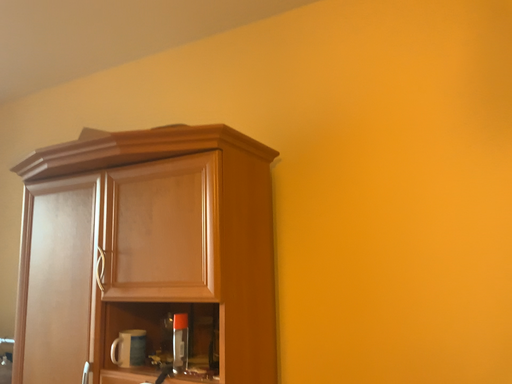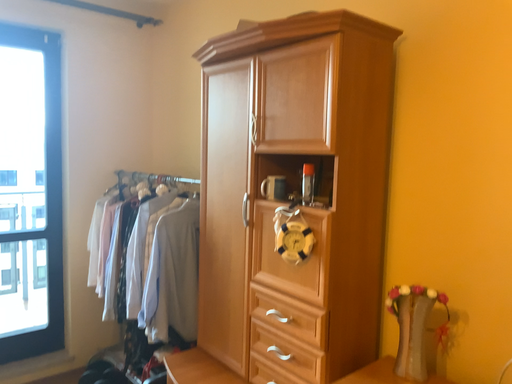
Question: How did the camera likely rotate when shooting the video?

Choices:
 (A) rotated downward
 (B) rotated upward

Answer: (A)